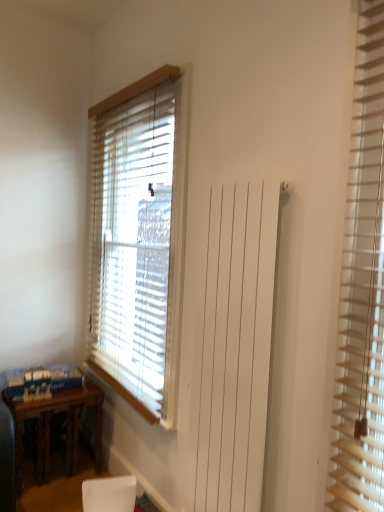
Question: In terms of width, does wooden blinds at right, the 1th window blind when ordered from front to back, look wider or thinner when compared to brown wooden table at lower left?

Choices:
 (A) wide
 (B) thin

Answer: (B)

Question: Is wooden blinds at right, marked as the 2th window blind in a left-to-right arrangement, spatially inside brown wooden table at lower left, or outside of it?

Choices:
 (A) outside
 (B) inside

Answer: (A)

Question: Which object is the farthest from the brown wooden table at lower left?

Choices:
 (A) wooden blinds at center, the first window blind viewed from the back
 (B) white matte armchair at lower center
 (C) wooden blinds at right, the 1th window blind when ordered from front to back

Answer: (C)

Question: Which object is positioned farthest from the brown wooden table at lower left?

Choices:
 (A) wooden blinds at center, which is counted as the 1th window blind, starting from the left
 (B) white matte armchair at lower center
 (C) wooden blinds at right, marked as the 2th window blind in a left-to-right arrangement

Answer: (C)